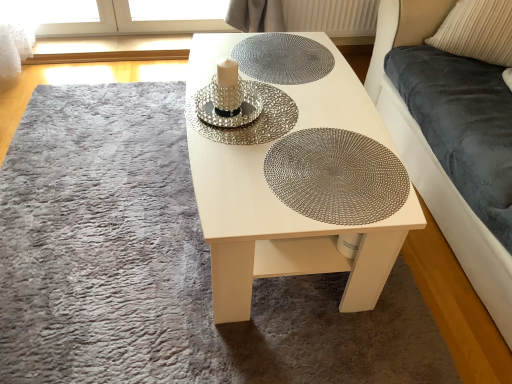
I want to click on free location in front of silver metallic plate at center, the second glass plate from the top, so click(228, 176).